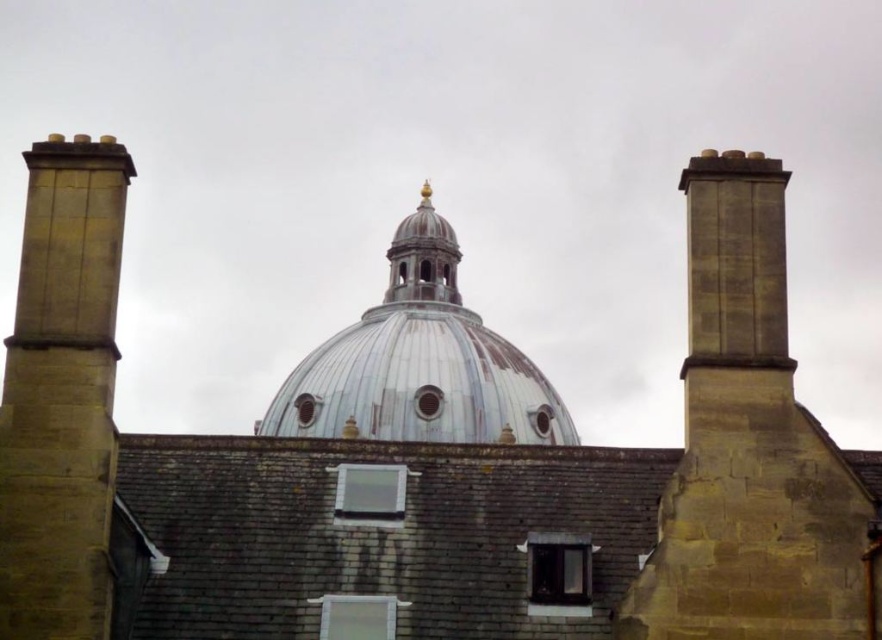
You are standing at the center of the dome structure and want to walk to the brown stone chimney at left. In which direction should you go?

The brown stone chimney at left is located at point (x=62, y=394), so you should go to the left direction to reach it.

You are an architect designing a new building. You want to place a new rectangular window on the brown stone chimney at left so it matches the proportions of the metallic silver dome at center. Given that the dome is wider, should the window on the chimney be wider or narrower than the dome?

The brown stone chimney at left is thinner than the metallic silver dome at center, so the window on the brown stone chimney at left should be narrower than the dome to maintain proportional harmony.